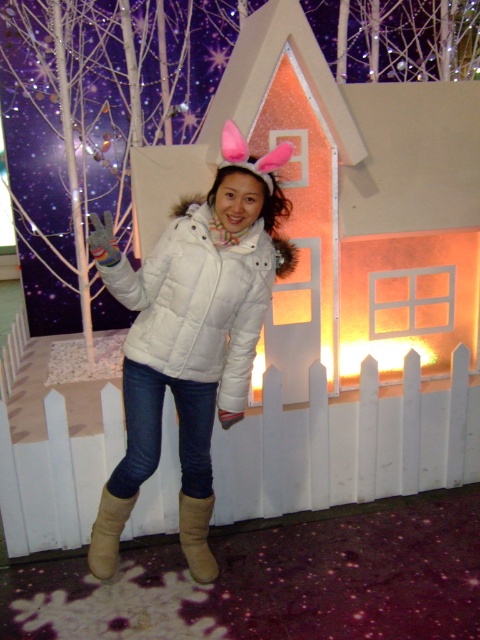
Is brown suede boot at lower center to the right of tan suede boot at lower center from the viewer's perspective?

Indeed, brown suede boot at lower center is positioned on the right side of tan suede boot at lower center.

Does brown suede boot at lower center come behind tan suede boot at lower center?

Yes, brown suede boot at lower center is behind tan suede boot at lower center.

Between point (210, 566) and point (108, 497), which one is positioned behind?

Point (210, 566)

I want to click on brown suede boot at lower center, so click(x=196, y=536).

Is white matte jacket at center below brown suede boot at lower center?

Incorrect, white matte jacket at center is not positioned below brown suede boot at lower center.

Is white matte jacket at center wider than brown suede boot at lower center?

Yes.

This screenshot has width=480, height=640. What do you see at coordinates (191, 324) in the screenshot? I see `white matte jacket at center` at bounding box center [191, 324].

Image resolution: width=480 pixels, height=640 pixels. What are the coordinates of `white matte jacket at center` in the screenshot? It's located at (191, 324).

Does white puffy jacket at center appear under tan suede boot at lower center?

Actually, white puffy jacket at center is above tan suede boot at lower center.

In the scene shown: Is white puffy jacket at center to the left of tan suede boot at lower center from the viewer's perspective?

In fact, white puffy jacket at center is to the right of tan suede boot at lower center.

Between point (157, 340) and point (117, 540), which one is positioned behind?

The point (117, 540) is behind.

This screenshot has width=480, height=640. I want to click on white puffy jacket at center, so click(x=196, y=298).